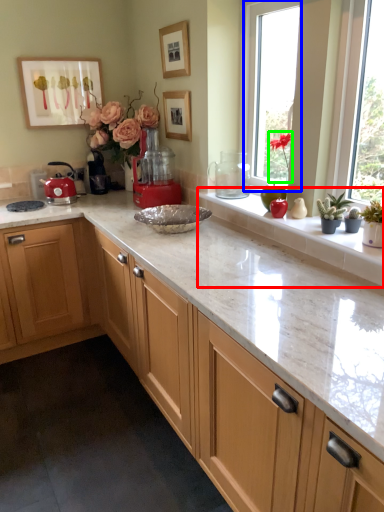
Question: Which is nearer to the window sill (highlighted by a red box)? window (highlighted by a blue box) or plant (highlighted by a green box).

Choices:
 (A) window
 (B) plant

Answer: (B)